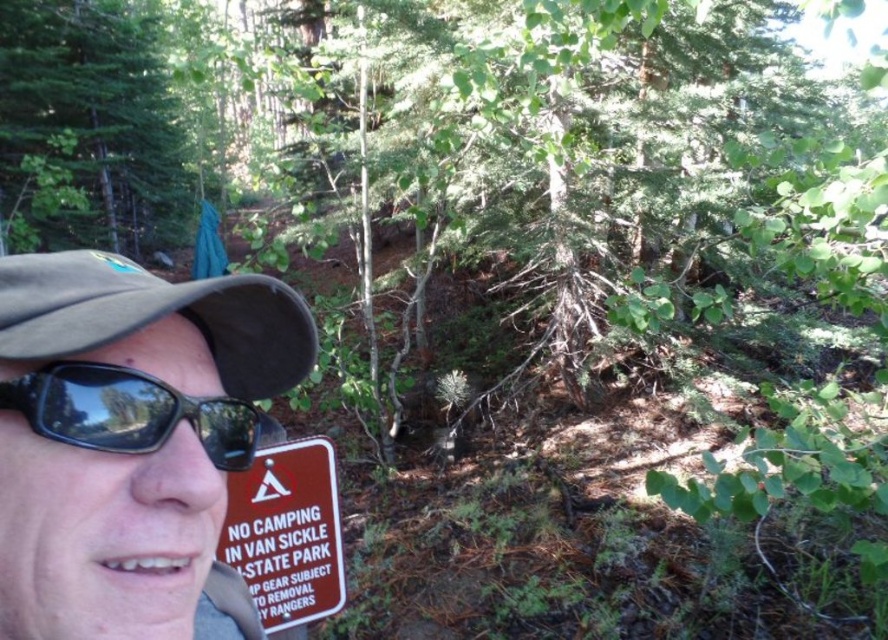
You are a photographer trying to capture the red plastic sign at lower left clearly. The matte brown cap at upper left is blocking part of the view. Can you estimate whether the cap is wider or narrower than the sign?

The matte brown cap at upper left has a lesser width compared to the red plastic sign at lower left, so the cap is narrower than the sign.